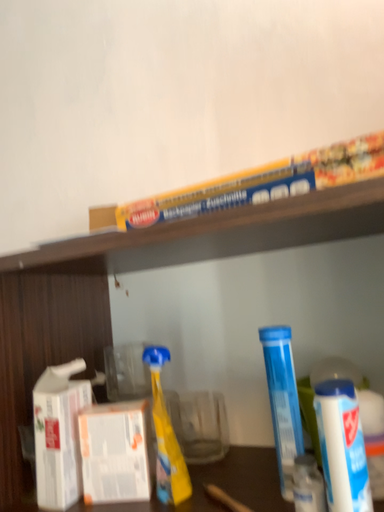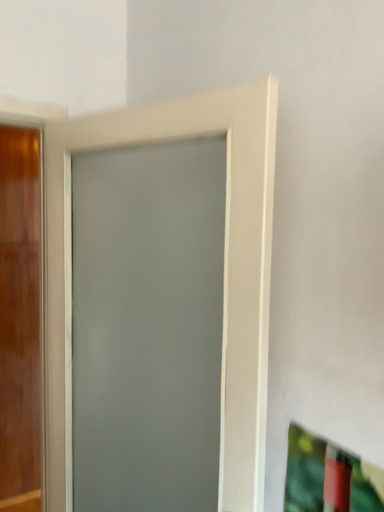
Question: Which way did the camera rotate in the video?

Choices:
 (A) rotated left
 (B) rotated right

Answer: (A)